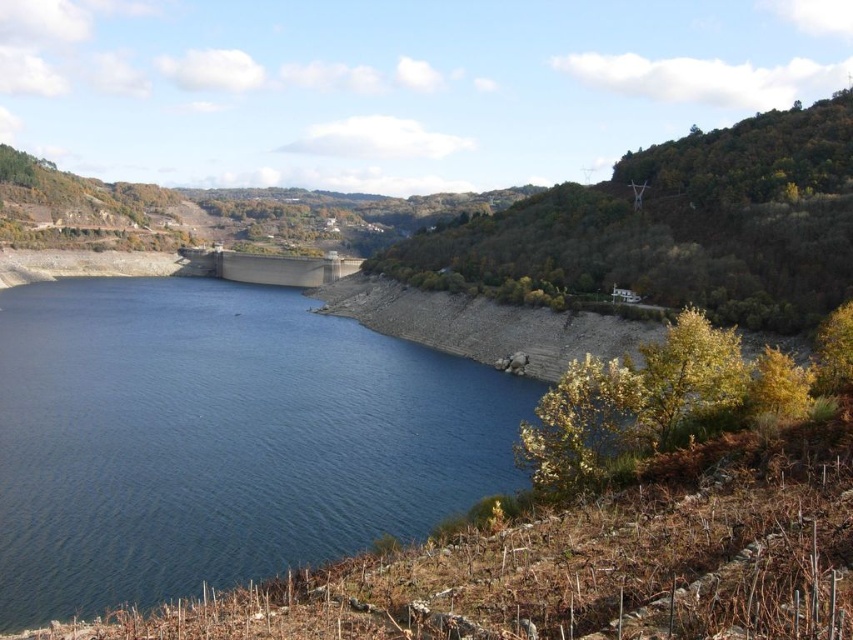
Who is positioned more to the right, blue water at center or gray concrete dam at center?

Positioned to the right is blue water at center.

Does blue water at center appear on the left side of gray concrete dam at center?

In fact, blue water at center is to the right of gray concrete dam at center.

This screenshot has width=853, height=640. Identify the location of blue water at center. (221, 440).